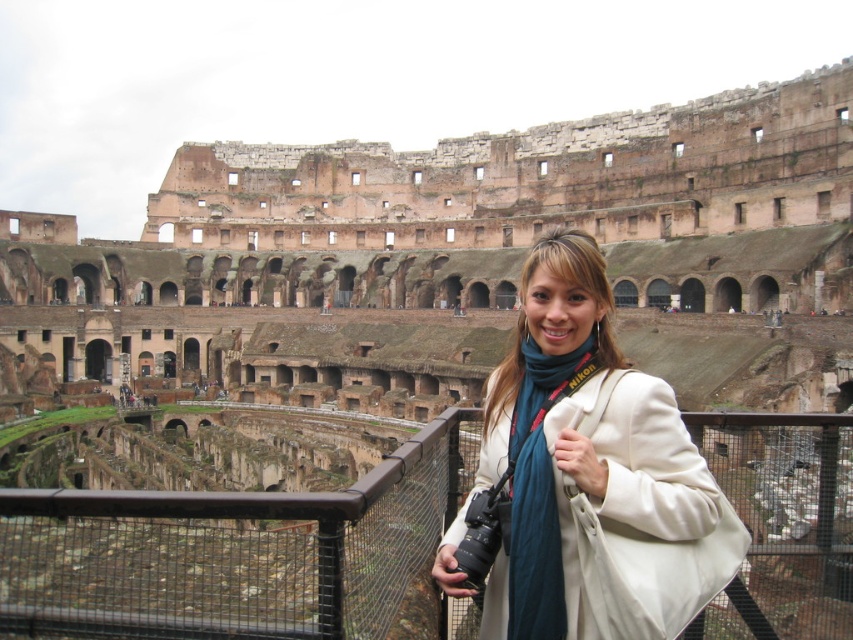
You are a photographer planning to take a picture of the Colosseum with the tourist wearing the white fabric jacket at center in the foreground. If your camera has a depth of field that can sharply focus on objects within 40 meters, will the tourist and the Colosseum both be in focus?

The distance between the white fabric jacket at center and the camera is 40.46 meters. Since the camera can only sharply focus within 40 meters, the tourist wearing the white fabric jacket at center will be slightly out of focus, while the Colosseum in the background may be in focus depending on its distance beyond the tourist.

You are a photographer trying to capture a wide shot of the Colosseum. You are standing at the point marked as point (531, 468). The camera you are using has a maximum focal length that allows it to capture objects up to 50 meters away. Will you be able to include the entire Colosseum in your shot?

The point (531, 468) is 46.95 meters away from the camera. Since this distance is within the camera maximum focal length of 50 meters, yes, you will be able to include the entire Colosseum in your shot.

You are a tourist standing at the Colosseum in Rome. You want to take a photo of the ancient structure while avoiding any modern elements like fences. There is a point marked at coordinates point [231,552]. Is this point on the black metal fence at lower center that you should avoid?

The point [231,552] corresponds to the black metal fence at lower center, so you should avoid this point to exclude the modern fence from your photo.